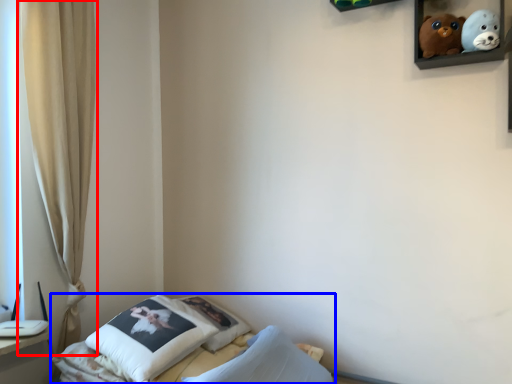
Question: Which point is further to the camera, curtain (highlighted by a red box) or bed (highlighted by a blue box)?

Choices:
 (A) curtain
 (B) bed

Answer: (A)